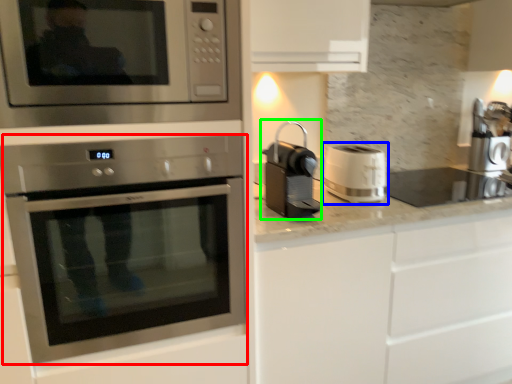
Question: Which is nearer to the oven (highlighted by a red box)? appliance (highlighted by a blue box) or coffee machine (highlighted by a green box).

Choices:
 (A) appliance
 (B) coffee machine

Answer: (B)